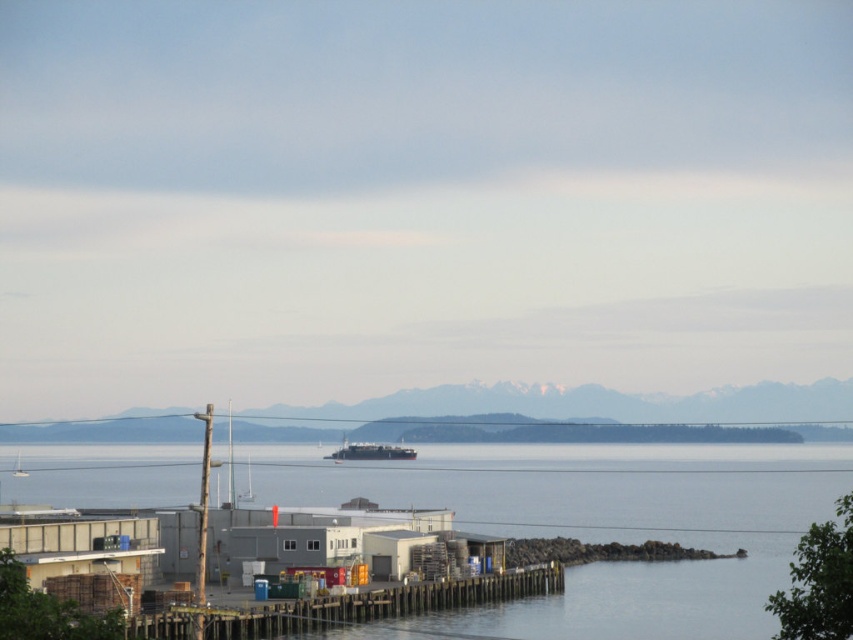
You are standing on the dock and want to take a photo of the clear water at dock center and the wooden at lower left. Which object will appear larger in your photo?

The clear water at dock center will appear larger in the photo because it is closer to the viewer than the wooden at lower left.

You are a photographer planning to capture the waterfront scene. You want to ensure that the clear water at dock center and the metallic gray barge at center are both visible in your shot. Given their sizes, which object should you prioritize framing closer to the center of your photo to include both effectively?

The clear water at dock center is larger in size than the metallic gray barge at center. To include both effectively, prioritize framing the larger clear water at dock center closer to the center of your photo, allowing the smaller metallic gray barge at center to occupy a complementary position.

You are standing on the dock and want to take a photo of the metallic gray barge at center. To ensure the barge is in focus, should you focus on the clear water at dock center or behind it?

The clear water at dock center is closer to the viewer than the metallic gray barge at center. To focus on the barge, you should focus behind the clear water at dock center.